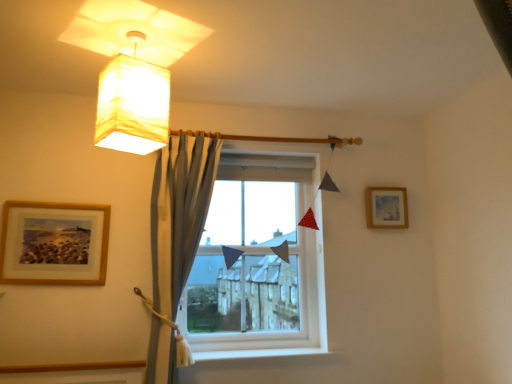
Question: Is wooden framed picture at upper right, which is the second picture frame from front to back, spatially inside clear glass window at center, or outside of it?

Choices:
 (A) inside
 (B) outside

Answer: (B)

Question: Looking at the image, does wooden framed picture at upper right, which is the second picture frame from front to back, seem bigger or smaller compared to clear glass window at center?

Choices:
 (A) big
 (B) small

Answer: (B)

Question: Which of these objects is positioned farthest from the wooden picture frame at left, which is counted as the second picture frame, starting from the back?

Choices:
 (A) satin blue curtain at center
 (B) wooden framed picture at upper right, acting as the 1th picture frame starting from the back
 (C) matte yellow fabric lampshade at upper left
 (D) clear glass window at center

Answer: (B)

Question: Which object is the closest to the satin blue curtain at center?

Choices:
 (A) wooden framed picture at upper right, marked as the 1th picture frame in a right-to-left arrangement
 (B) clear glass window at center
 (C) wooden picture frame at left, which is counted as the second picture frame, starting from the back
 (D) matte yellow fabric lampshade at upper left

Answer: (B)